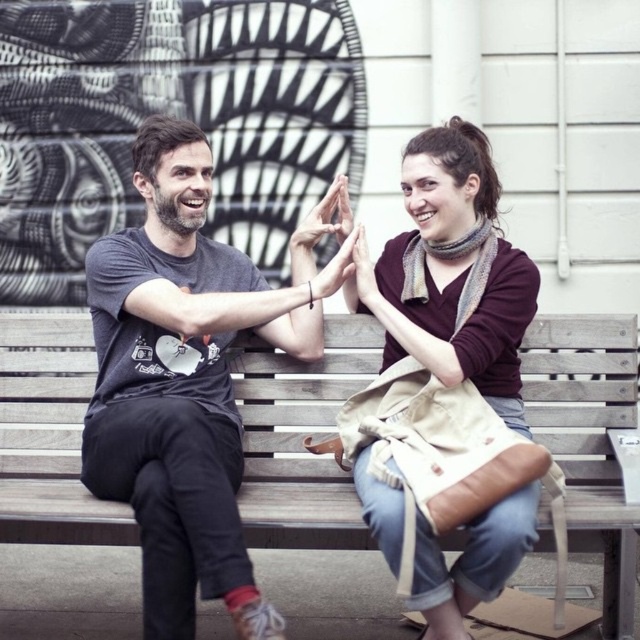
You are designing a storage system and need to place the wooden bench at center and the maroon sweater at center into a storage container. The container has a width limit of 1.2 meters. Based on the scene description, can both items fit side by side in the container without overlapping?

The wooden bench at center might be wider than maroon sweater at center, but since the exact widths are not provided, it is uncertain if their combined width exceeds the container limit of 1.2 meters. Further measurements are needed to determine if they can fit side by side.